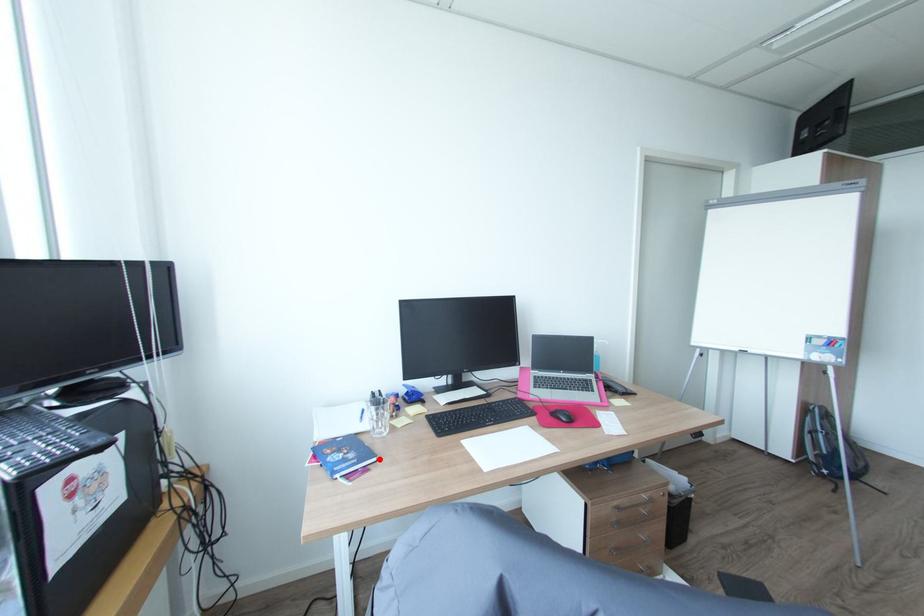
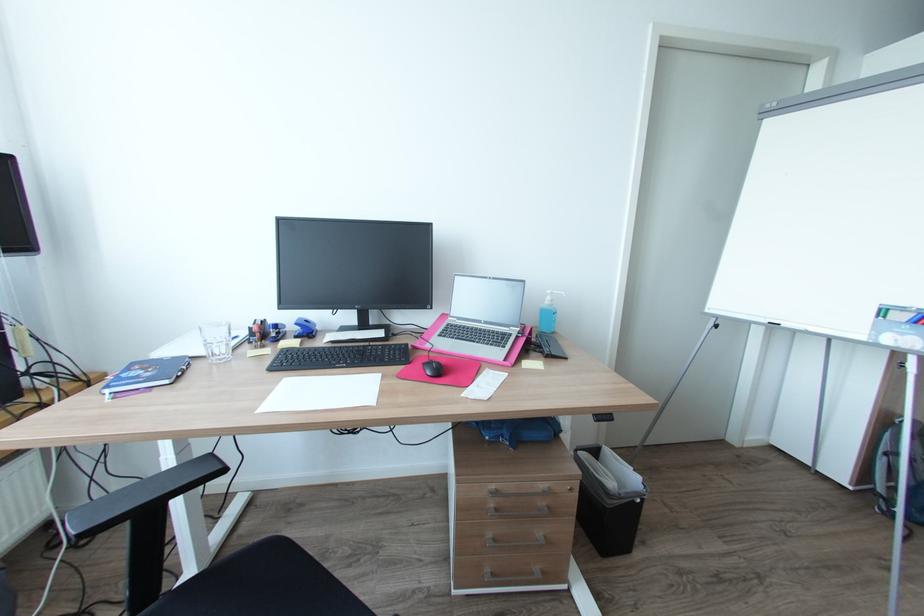
Question: I am providing you with two images of the same scene from different viewpoints. A red point is marked on the first image. Is the red point's position out of view in image 2?

Choices:
 (A) Yes
 (B) No

Answer: (B)